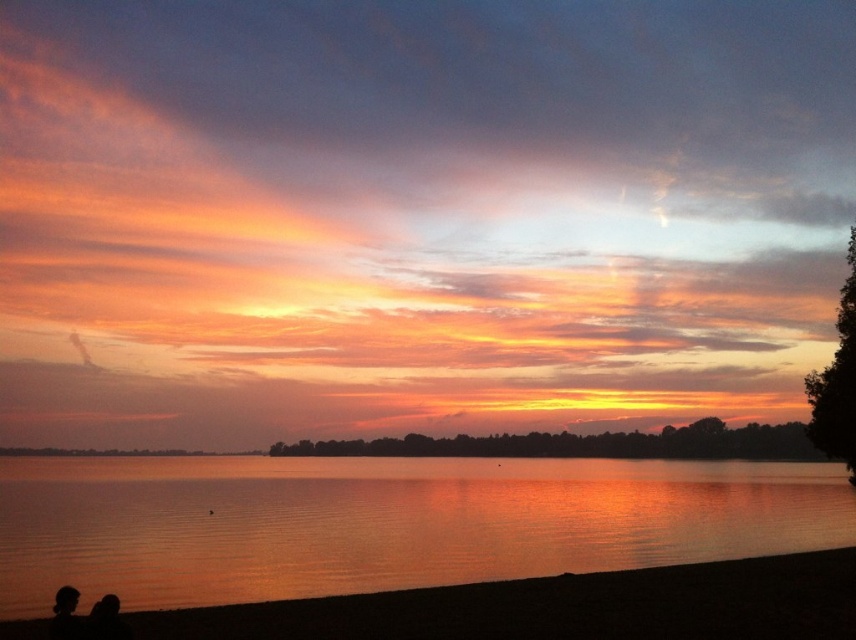
Is silhouette couple at lower left positioned before silhouette skin at lower left?

Yes, it is in front of silhouette skin at lower left.

Where is `silhouette couple at lower left`? This screenshot has height=640, width=856. silhouette couple at lower left is located at coordinates (86, 618).

Can you confirm if shiny reflective water at center is positioned above silhouette skin at lower left?

No.

Does shiny reflective water at center appear on the left side of silhouette skin at lower left?

Indeed, shiny reflective water at center is positioned on the left side of silhouette skin at lower left.

Describe the element at coordinates (384, 522) in the screenshot. This screenshot has height=640, width=856. I see `shiny reflective water at center` at that location.

I want to click on shiny reflective water at center, so click(384, 522).

Who is lower down, shiny reflective water at center or silhouette couple at lower left?

Result: Positioned lower is shiny reflective water at center.

Locate an element on the screen. shiny reflective water at center is located at coordinates click(384, 522).

Is point (138, 480) more distant than point (114, 609)?

Yes, it is.

Locate an element on the screen. The image size is (856, 640). shiny reflective water at center is located at coordinates tap(384, 522).